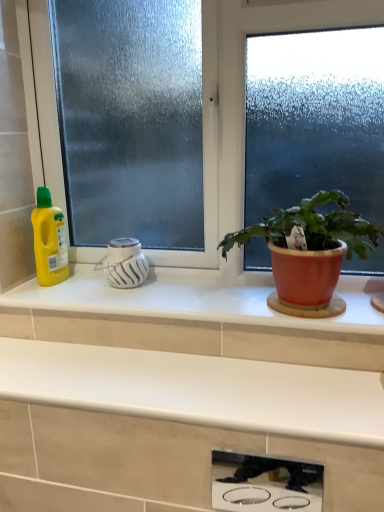
What are the coordinates of `free spot to the left of matte terracotta pot at right` in the screenshot? It's located at (173, 298).